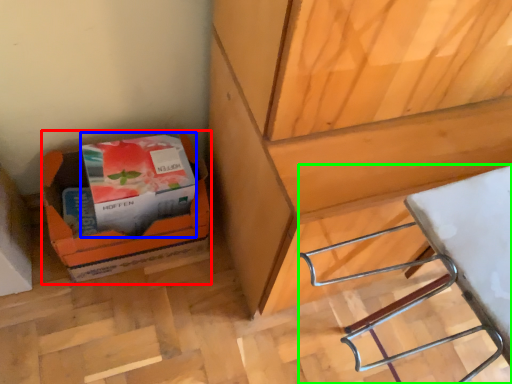
Question: Based on their relative distances, which object is nearer to cardboard box (highlighted by a red box)? Choose from paperback book (highlighted by a blue box) and wood (highlighted by a green box).

Choices:
 (A) paperback book
 (B) wood

Answer: (A)